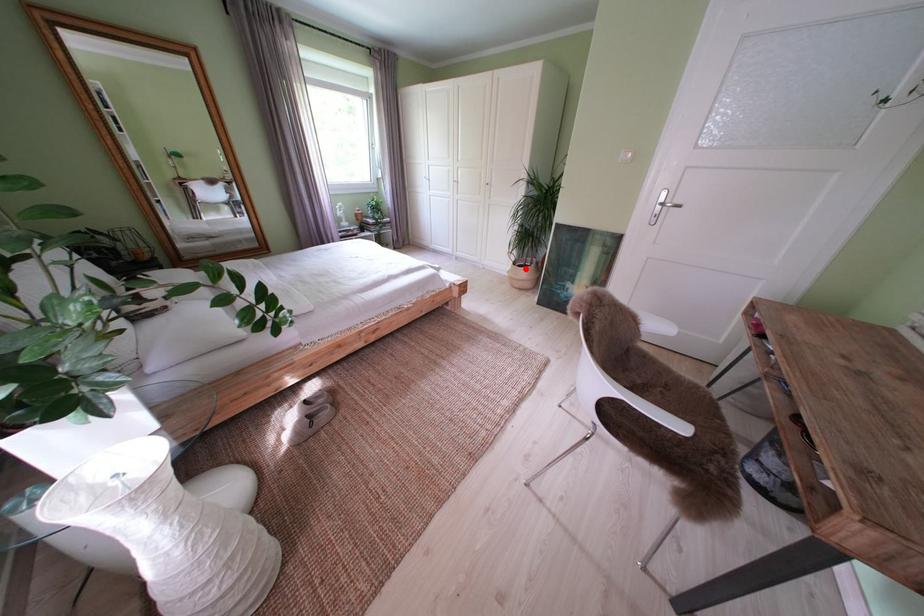
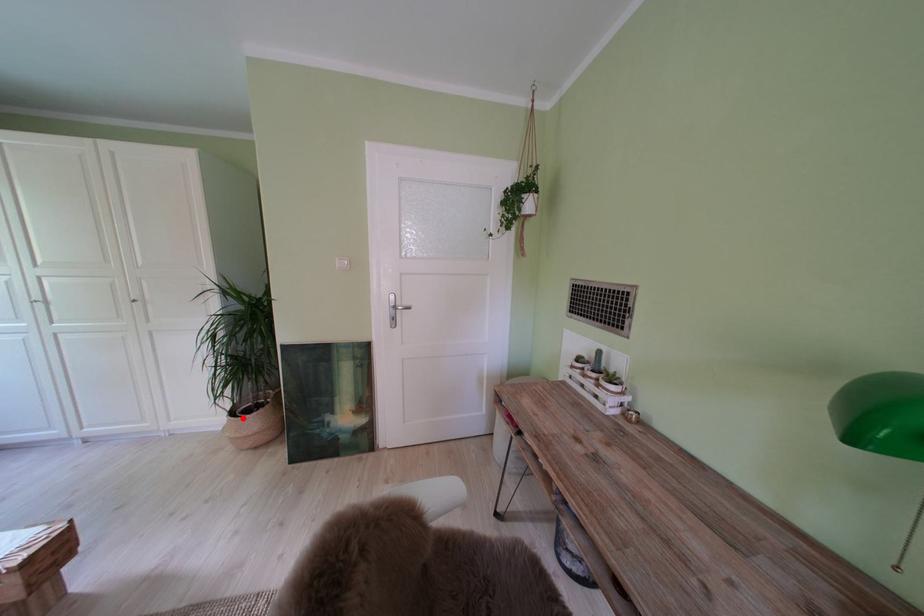
I am providing you with two images of the same scene from different viewpoints. A red point is marked on the first image and another point is marked on the second image. Do the highlighted points in image1 and image2 indicate the same real-world spot?

Yes